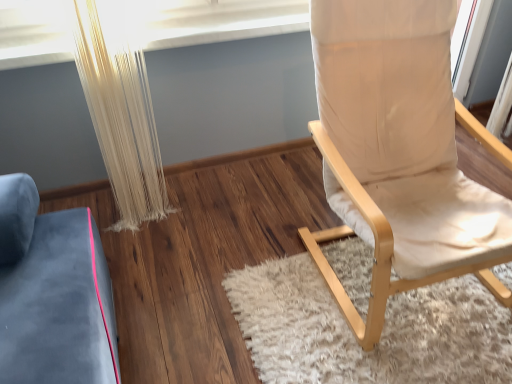
You are a GUI agent. You are given a task and a screenshot of the screen. Output one action in this format:
    pyautogui.click(x=<x>, y=<y>)
    Task: Click on the vacant space that is in between beige fabric chair at right and white textured curtain at left
    Image resolution: width=512 pixels, height=384 pixels.
    Given the screenshot: What is the action you would take?
    pyautogui.click(x=224, y=228)